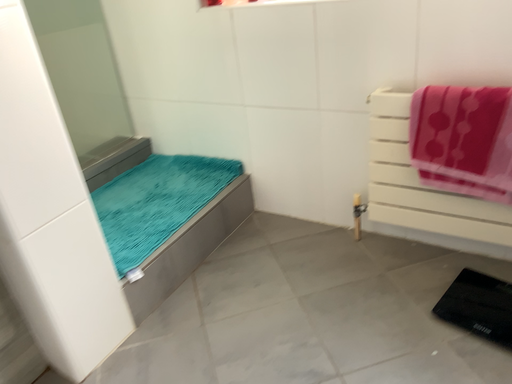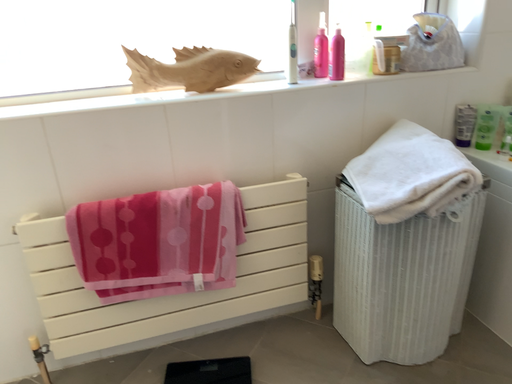
Question: Which way did the camera rotate in the video?

Choices:
 (A) rotated downward
 (B) rotated upward

Answer: (B)